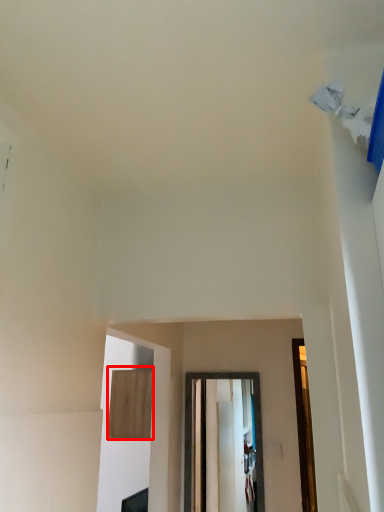
Question: Observing the image, what is the correct spatial positioning of plywood (annotated by the red box) in reference to glass door?

Choices:
 (A) right
 (B) left

Answer: (B)